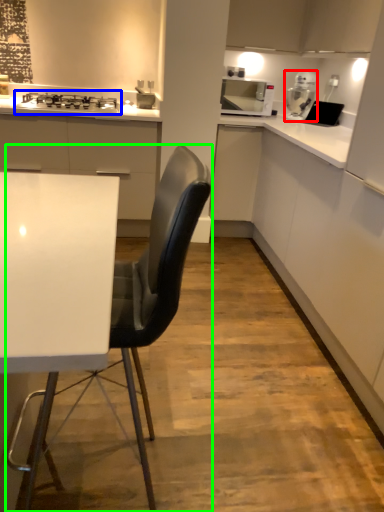
Question: Which object is positioned farthest from kitchen appliance (highlighted by a red box)? Select from gas stove (highlighted by a blue box) and chair (highlighted by a green box).

Choices:
 (A) gas stove
 (B) chair

Answer: (B)